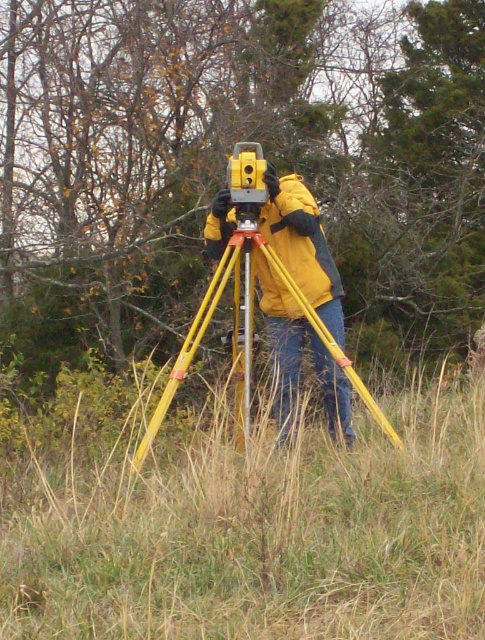
Based on the scene description, where is the green leafy tree at center located in terms of its 2D coordinates?

The green leafy tree at center is located at the 2D coordinates of point (226,156).

Based on the scene description, where is the yellow matte tripod at center located in the image?

The yellow matte tripod at center is located at point (297, 355) in the image.